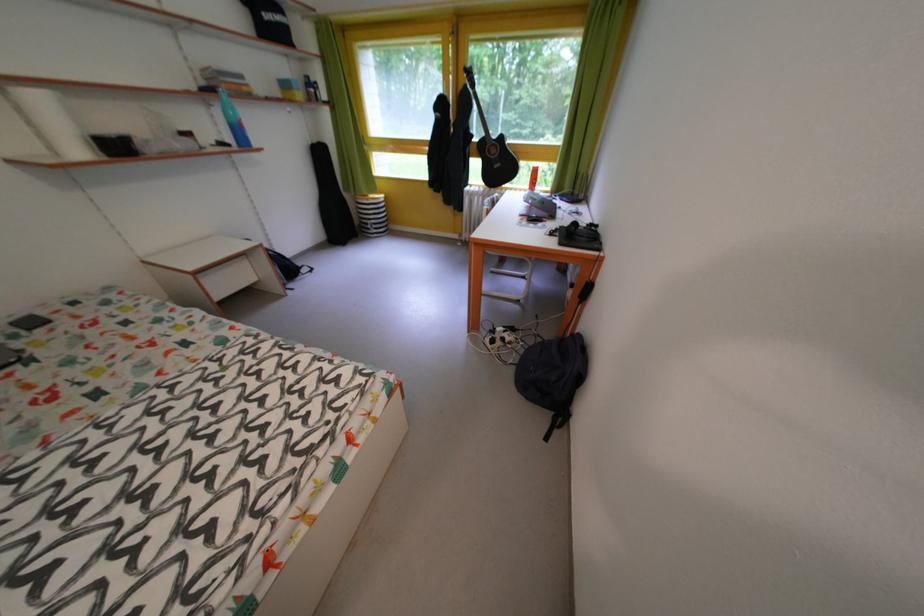
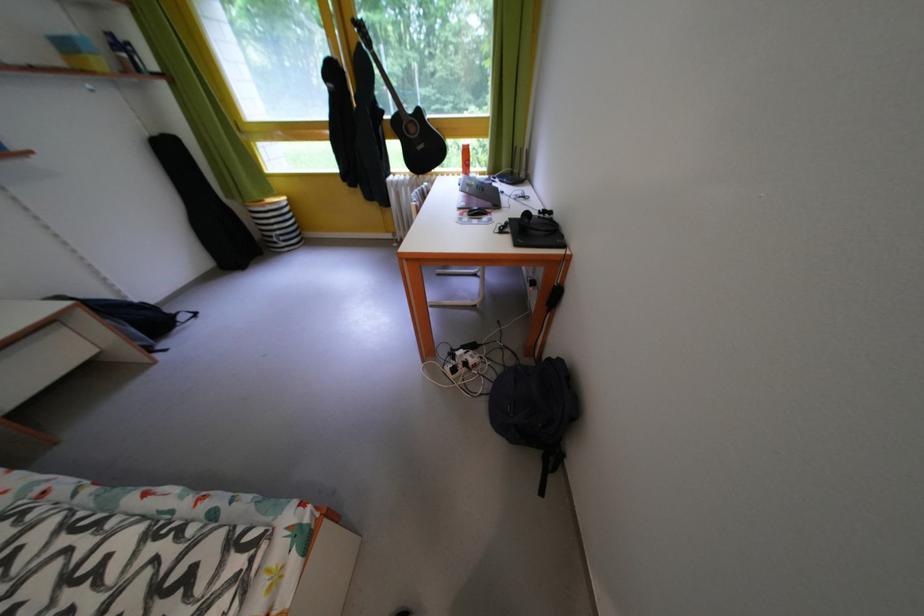
Where in the second image is the point corresponding to point 383,227 from the first image?

(287, 238)